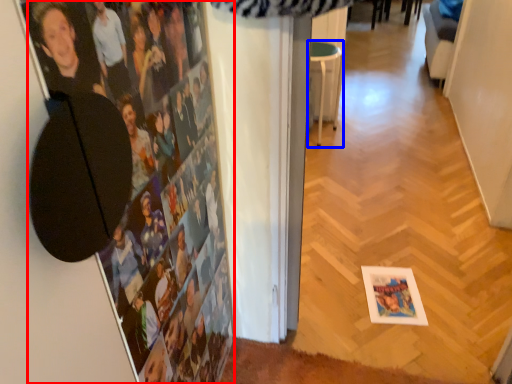
Question: Which object is closer to the camera taking this photo, person (highlighted by a red box) or furniture (highlighted by a blue box)?

Choices:
 (A) person
 (B) furniture

Answer: (A)